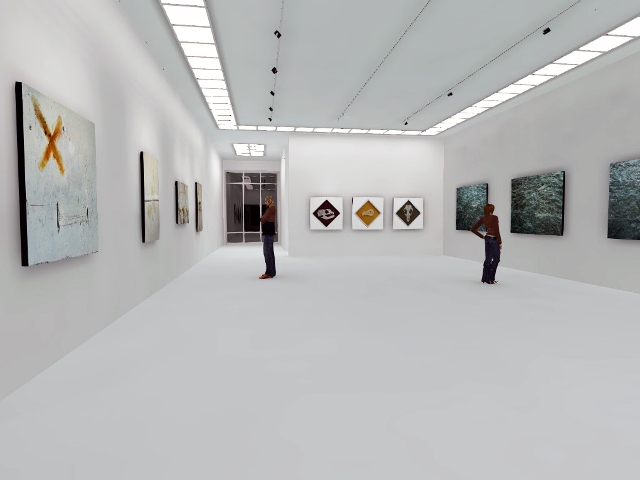
The image size is (640, 480). I want to click on large paintings, so click(x=467, y=195), click(x=534, y=196), click(x=628, y=192).